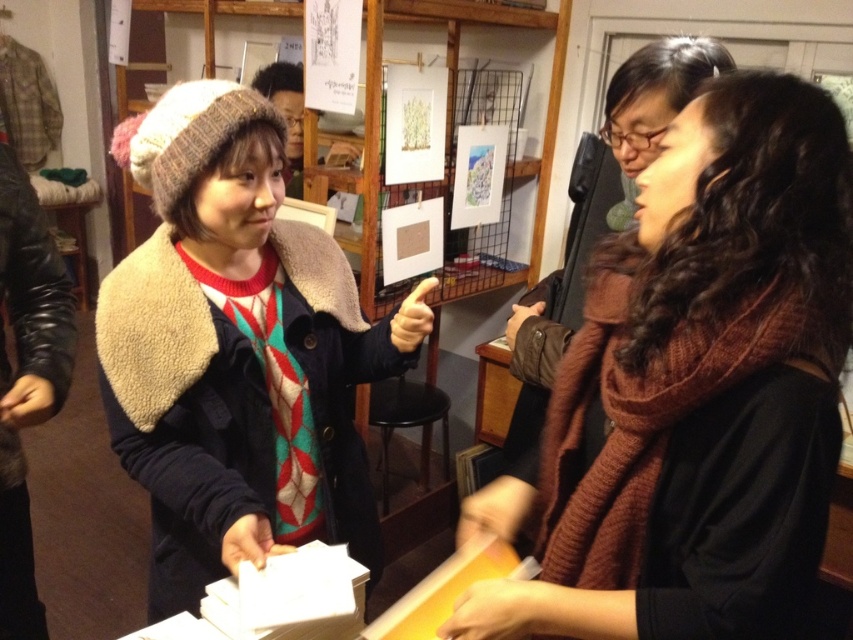
You are standing in the gallery and notice the knitted woolen hat at upper left. Where exactly is it positioned in the image?

The knitted woolen hat at upper left is located at point coordinates of 0.552 on the x axis and 0.280 on the y axis.

Looking at this image, you are standing in the gallery and see the point labeled at coordinate (692, 390). Which object does this point lie on?

The point labeled at coordinate (692, 390) lies on the brown knitted scarf at center.